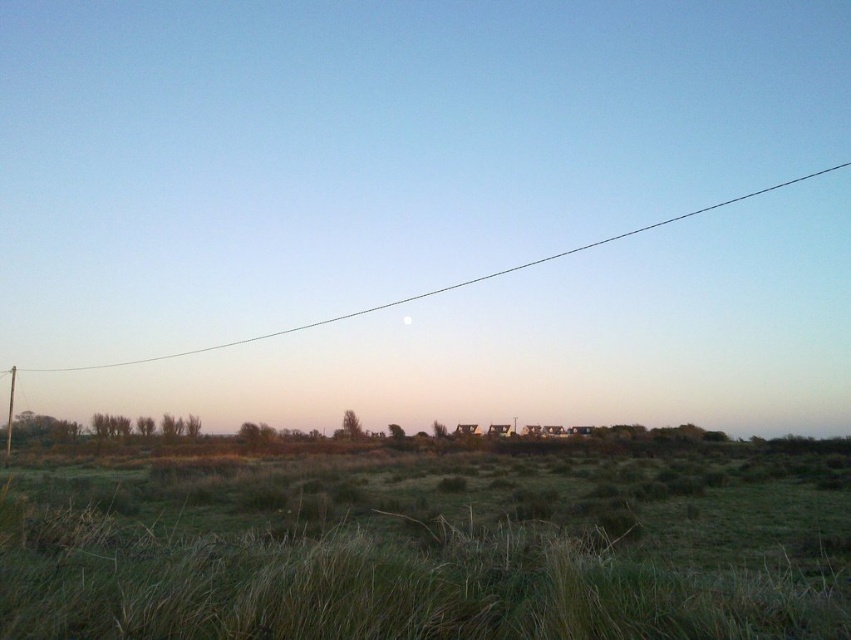
Question: Does green grassy at lower center have a larger size compared to clear wire at upper center?

Choices:
 (A) yes
 (B) no

Answer: (B)

Question: Considering the real-world distances, which object is closest to the white glossy moon at upper center?

Choices:
 (A) clear wire at upper center
 (B) green grassy at lower center

Answer: (A)

Question: Which point appears farthest from the camera in this image?

Choices:
 (A) (403, 316)
 (B) (790, 561)
 (C) (540, 260)

Answer: (C)

Question: Is green grassy at lower center behind white glossy moon at upper center?

Choices:
 (A) no
 (B) yes

Answer: (A)

Question: Does green grassy at lower center have a lesser width compared to clear wire at upper center?

Choices:
 (A) no
 (B) yes

Answer: (B)

Question: Among these objects, which one is farthest from the camera?

Choices:
 (A) white glossy moon at upper center
 (B) green grassy at lower center
 (C) clear wire at upper center

Answer: (A)